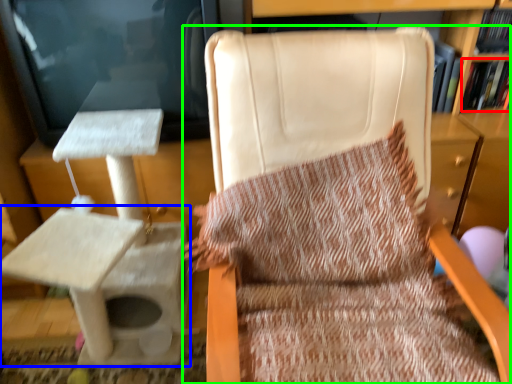
Question: Which is nearer to the book (highlighted by a red box)? table (highlighted by a blue box) or chair (highlighted by a green box).

Choices:
 (A) table
 (B) chair

Answer: (B)